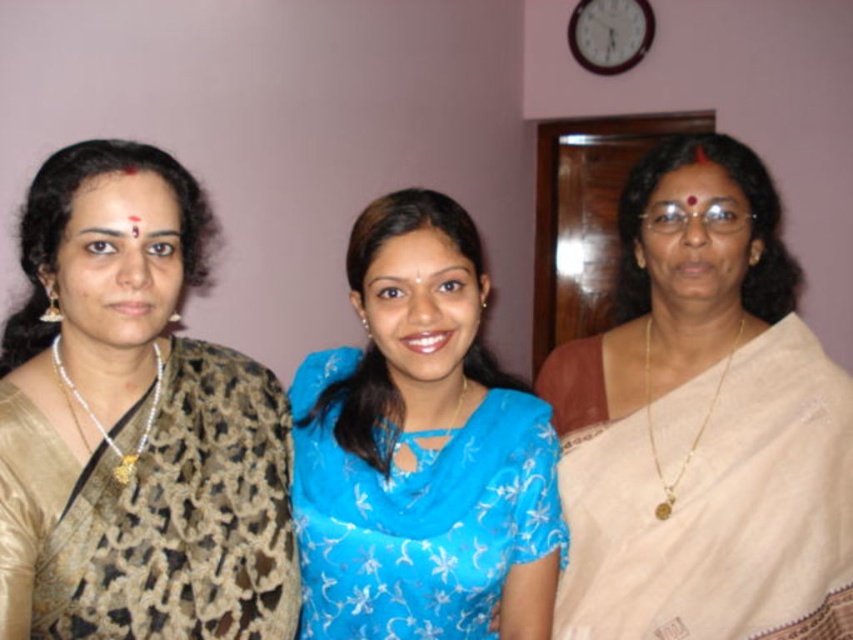
Question: Does brown textured saree at left appear under blue floral saree at center?

Choices:
 (A) no
 (B) yes

Answer: (A)

Question: Is beige silk saree at right wider than brown textured saree at left?

Choices:
 (A) no
 (B) yes

Answer: (B)

Question: Which object is positioned closest to the brown textured saree at left?

Choices:
 (A) blue floral saree at center
 (B) beige silk saree at right

Answer: (A)

Question: From the image, what is the correct spatial relationship of brown textured saree at left in relation to blue floral saree at center?

Choices:
 (A) above
 (B) below

Answer: (A)

Question: Among these objects, which one is farthest from the camera?

Choices:
 (A) beige silk saree at right
 (B) brown textured saree at left
 (C) blue floral saree at center

Answer: (A)

Question: Which of the following is the farthest from the observer?

Choices:
 (A) brown textured saree at left
 (B) blue floral saree at center

Answer: (B)